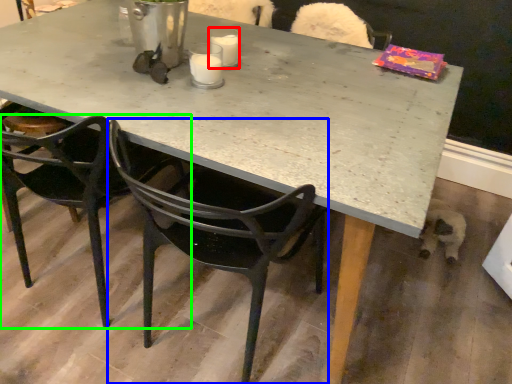
Question: Estimate the real-world distances between objects in this image. Which object is farther from coffee cup (highlighted by a red box), chair (highlighted by a blue box) or chair (highlighted by a green box)?

Choices:
 (A) chair
 (B) chair

Answer: (B)